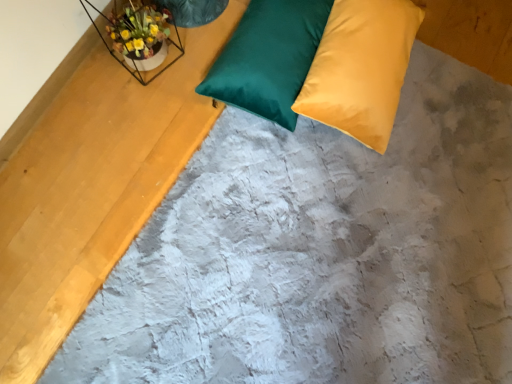
Question: From a real-world perspective, is metallic wire frame at upper left below satin green pillow at upper center, positioned as the 2th pillow in right-to-left order?

Choices:
 (A) no
 (B) yes

Answer: (A)

Question: Is metallic wire frame at upper left not inside satin green pillow at upper center, arranged as the 1th pillow when viewed from the left?

Choices:
 (A) yes
 (B) no

Answer: (A)

Question: Does metallic wire frame at upper left have a lesser width compared to satin green pillow at upper center, positioned as the 2th pillow in right-to-left order?

Choices:
 (A) yes
 (B) no

Answer: (A)

Question: Can you confirm if metallic wire frame at upper left is positioned to the left of satin green pillow at upper center, arranged as the 1th pillow when viewed from the left?

Choices:
 (A) yes
 (B) no

Answer: (A)

Question: Can you confirm if metallic wire frame at upper left is shorter than satin green pillow at upper center, arranged as the 1th pillow when viewed from the left?

Choices:
 (A) yes
 (B) no

Answer: (B)

Question: From a real-world perspective, is metallic wire frame at upper left on top of satin green pillow at upper center, positioned as the 2th pillow in right-to-left order?

Choices:
 (A) no
 (B) yes

Answer: (B)

Question: Considering the relative positions of satin green pillow at upper center, positioned as the 2th pillow in right-to-left order, and metallic wire frame at upper left in the image provided, is satin green pillow at upper center, positioned as the 2th pillow in right-to-left order, to the right of metallic wire frame at upper left from the viewer's perspective?

Choices:
 (A) yes
 (B) no

Answer: (A)

Question: Is the depth of satin green pillow at upper center, arranged as the 1th pillow when viewed from the left, less than that of metallic wire frame at upper left?

Choices:
 (A) no
 (B) yes

Answer: (A)

Question: Can you confirm if satin green pillow at upper center, positioned as the 2th pillow in right-to-left order, is shorter than metallic wire frame at upper left?

Choices:
 (A) no
 (B) yes

Answer: (B)

Question: Can you confirm if satin green pillow at upper center, arranged as the 1th pillow when viewed from the left, is smaller than metallic wire frame at upper left?

Choices:
 (A) yes
 (B) no

Answer: (B)

Question: Is satin green pillow at upper center, arranged as the 1th pillow when viewed from the left, thinner than metallic wire frame at upper left?

Choices:
 (A) no
 (B) yes

Answer: (A)

Question: Is satin green pillow at upper center, arranged as the 1th pillow when viewed from the left, further to camera compared to metallic wire frame at upper left?

Choices:
 (A) yes
 (B) no

Answer: (A)

Question: Is matte yellow pillow at upper right, the second pillow positioned from the left, positioned far away from metallic wire frame at upper left?

Choices:
 (A) yes
 (B) no

Answer: (B)